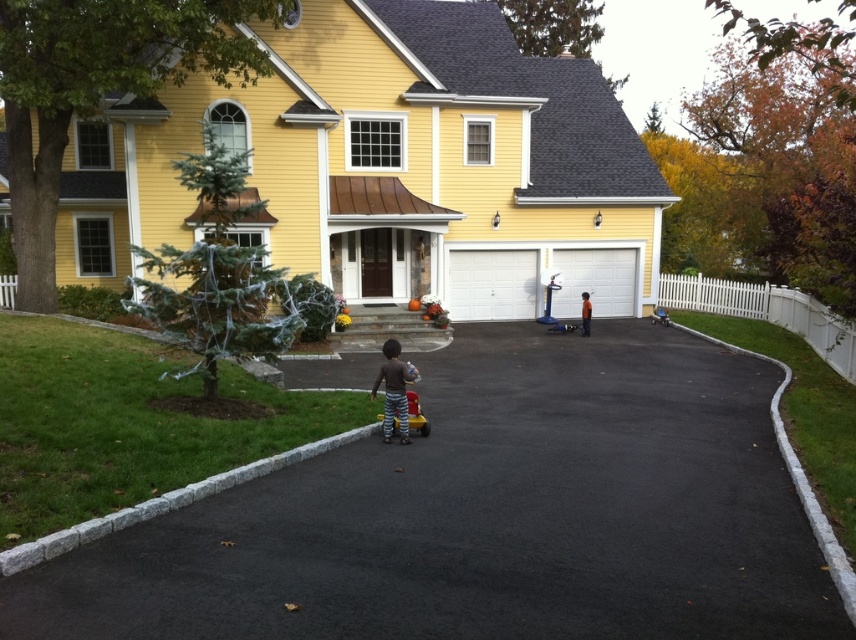
Question: Which object is the closest to the plastic red toy car at center?

Choices:
 (A) orange cotton shirt at center
 (B) black asphalt driveway at center

Answer: (B)

Question: Can you confirm if brown striped pants at center is wider than plastic red toy car at center?

Choices:
 (A) yes
 (B) no

Answer: (A)

Question: Which is nearer to the brown striped pants at center?

Choices:
 (A) orange cotton shirt at center
 (B) black asphalt driveway at center
 (C) plastic red toy car at center

Answer: (C)

Question: Does plastic red toy car at center have a larger size compared to orange cotton shirt at center?

Choices:
 (A) no
 (B) yes

Answer: (A)

Question: Does brown striped pants at center appear on the right side of plastic red toy car at center?

Choices:
 (A) no
 (B) yes

Answer: (A)

Question: Among these objects, which one is nearest to the camera?

Choices:
 (A) brown striped pants at center
 (B) plastic red toy car at center
 (C) orange cotton shirt at center

Answer: (A)